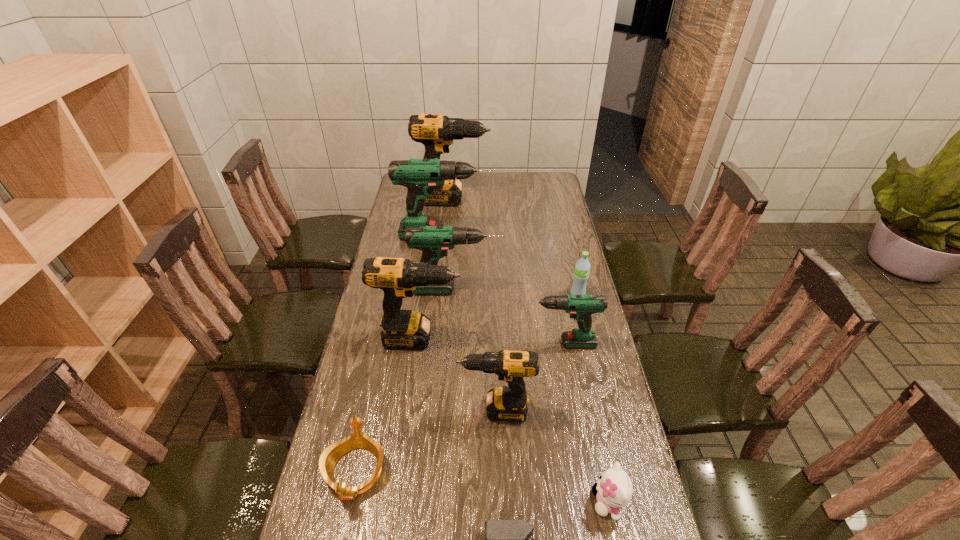
This screenshot has height=540, width=960. Identify the location of blank region between the biggest black drill and the nearest green drill. (506, 272).

Where is `free space between the biggest green drill and the ninth tallest object`? The height and width of the screenshot is (540, 960). free space between the biggest green drill and the ninth tallest object is located at coordinates (400, 353).

Locate an element on the screen. vacant area that lies between the smallest green drill and the farthest black drill is located at coordinates (506, 272).

Choose which object is the seventh nearest neighbor to the kitten. Please provide its 2D coordinates. Your answer should be formatted as a tuple, i.e. [(x, y)], where the tuple contains the x and y coordinates of a point satisfying the conditions above.

[(434, 241)]

The width and height of the screenshot is (960, 540). What are the coordinates of `the second closest object to the second smallest green drill` in the screenshot? It's located at (581, 307).

Select which drill is the third closest to the third farthest drill. Please provide its 2D coordinates. Your answer should be formatted as a tuple, i.e. [(x, y)], where the tuple contains the x and y coordinates of a point satisfying the conditions above.

[(420, 176)]

In order to click on the third closest drill to the water bottle in this screenshot , I will do `click(420, 176)`.

Identify which black drill is the closest to the fifth nearest drill. Please provide its 2D coordinates. Your answer should be formatted as a tuple, i.e. [(x, y)], where the tuple contains the x and y coordinates of a point satisfying the conditions above.

[(436, 132)]

Identify which black drill is located as the second nearest to the nearest black drill. Please provide its 2D coordinates. Your answer should be formatted as a tuple, i.e. [(x, y)], where the tuple contains the x and y coordinates of a point satisfying the conditions above.

[(436, 132)]

Locate which green drill ranks in proximity to the nearest object. Please provide its 2D coordinates. Your answer should be formatted as a tuple, i.e. [(x, y)], where the tuple contains the x and y coordinates of a point satisfying the conditions above.

[(581, 307)]